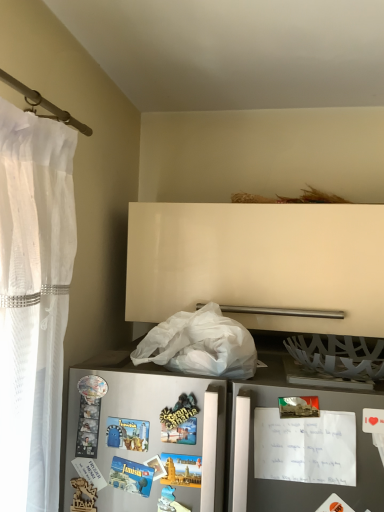
Question: Based on their sizes in the image, would you say metallic gray refrigerator at lower left is bigger or smaller than white matte plastic bag at lower center?

Choices:
 (A) big
 (B) small

Answer: (B)

Question: Considering the positions of metallic gray refrigerator at lower left and white matte plastic bag at lower center in the image, is metallic gray refrigerator at lower left wider or thinner than white matte plastic bag at lower center?

Choices:
 (A) thin
 (B) wide

Answer: (A)

Question: Which object is the closest to the metallic postcard at right?

Choices:
 (A) metallic gray refrigerator at lower left
 (B) white matte plastic bag at lower center

Answer: (A)

Question: Which of these objects is positioned farthest from the metallic gray refrigerator at lower left?

Choices:
 (A) metallic postcard at right
 (B) white matte plastic bag at lower center

Answer: (B)